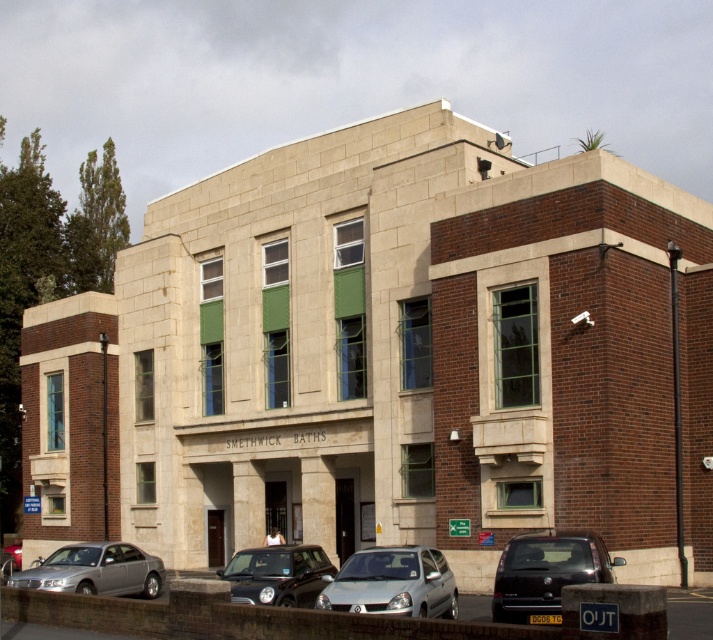
Question: Estimate the real-world distances between objects in this image. Which object is closer to the shiny black car at center?

Choices:
 (A) silver metallic sedan at lower left
 (B) dark gray metallic van at lower right
 (C) silver metallic hatchback at center

Answer: (C)

Question: Which object is closer to the camera taking this photo?

Choices:
 (A) silver metallic sedan at lower left
 (B) dark gray metallic van at lower right
 (C) shiny black car at center

Answer: (B)

Question: Can you confirm if dark gray metallic van at lower right is positioned below silver metallic sedan at lower left?

Choices:
 (A) yes
 (B) no

Answer: (B)

Question: Can you confirm if silver metallic sedan at lower left is smaller than shiny black car at center?

Choices:
 (A) no
 (B) yes

Answer: (A)

Question: From the image, what is the correct spatial relationship of silver metallic sedan at lower left in relation to shiny black car at center?

Choices:
 (A) above
 (B) below

Answer: (B)

Question: Which point is closer to the camera taking this photo?

Choices:
 (A) 309,557
 (B) 353,586
 (C) 530,598
 (D) 120,548

Answer: (C)